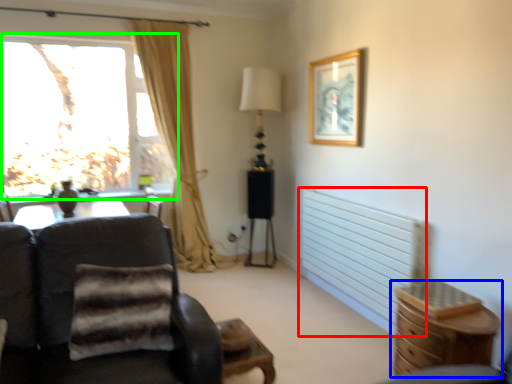
Question: Which object is the closest to the radiator (highlighted by a red box)? Choose among these: chest of drawers (highlighted by a blue box) or window (highlighted by a green box).

Choices:
 (A) chest of drawers
 (B) window

Answer: (A)